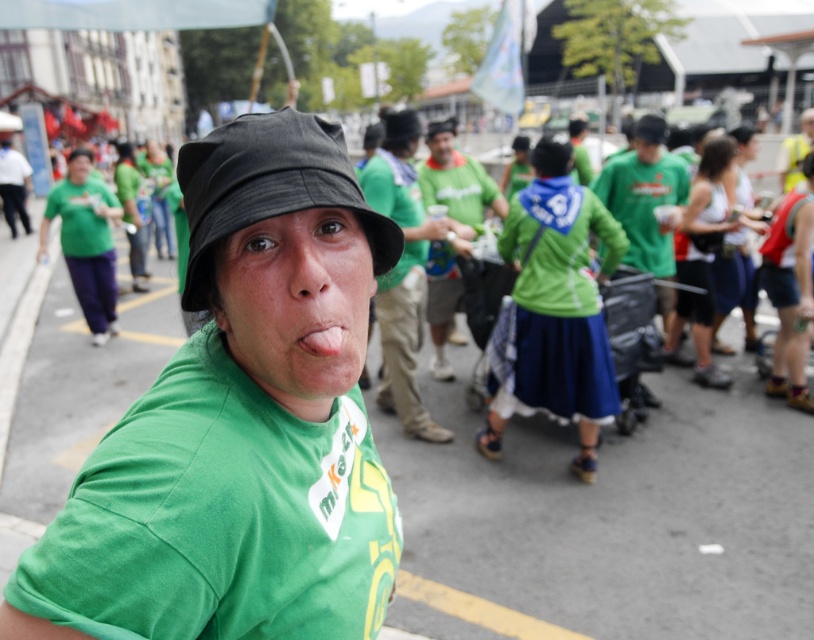
Question: Observing the image, what is the correct spatial positioning of white fabric tank top at right in reference to pink flesh at center?

Choices:
 (A) below
 (B) above

Answer: (B)

Question: Considering the relative positions of black fabric hat at center and pink flesh at center in the image provided, where is black fabric hat at center located with respect to pink flesh at center?

Choices:
 (A) right
 (B) left

Answer: (B)

Question: Which of the following is the closest to the observer?

Choices:
 (A) (265, 122)
 (B) (222, 493)
 (C) (313, 323)

Answer: (C)

Question: Does black fabric hat at center lie in front of white fabric tank top at right?

Choices:
 (A) no
 (B) yes

Answer: (B)

Question: Among these objects, which one is nearest to the camera?

Choices:
 (A) white fabric tank top at right
 (B) green matte shirt at center

Answer: (B)

Question: Which point is closer to the camera taking this photo?

Choices:
 (A) (204, 141)
 (B) (326, 348)

Answer: (B)